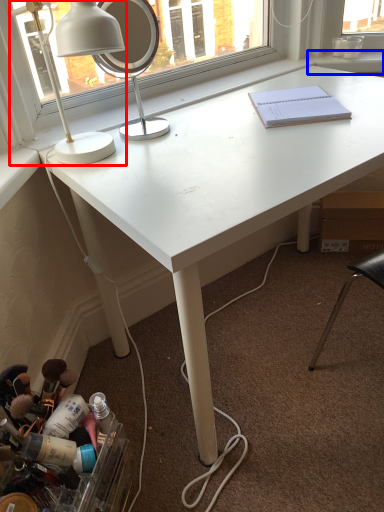
Question: Which point is further to the camera, lamp (highlighted by a red box) or window sill (highlighted by a blue box)?

Choices:
 (A) lamp
 (B) window sill

Answer: (B)